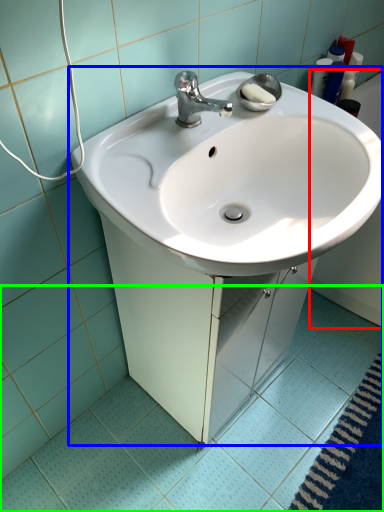
Question: Which is farther away from bath (highlighted by a red box)? sink (highlighted by a blue box) or ceramic tile (highlighted by a green box)?

Choices:
 (A) sink
 (B) ceramic tile

Answer: (A)